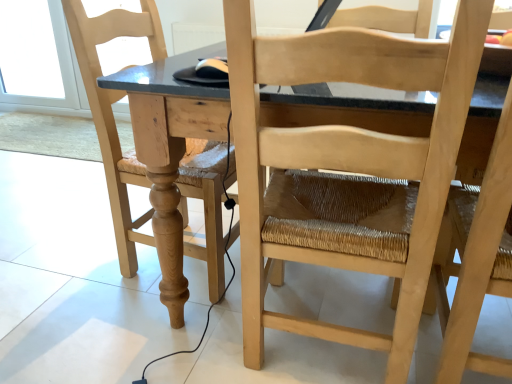
Question: Is natural wood chair at right, which is the 1th chair in right-to-left order, touching natural wood table at center?

Choices:
 (A) no
 (B) yes

Answer: (A)

Question: Does natural wood chair at right, which is the 1th chair in right-to-left order, have a smaller size compared to natural wood table at center?

Choices:
 (A) yes
 (B) no

Answer: (A)

Question: Is natural wood chair at right, which is the 1th chair in right-to-left order, wider than natural wood table at center?

Choices:
 (A) yes
 (B) no

Answer: (B)

Question: From a real-world perspective, is natural wood chair at right, the third chair positioned from the left, on natural wood table at center?

Choices:
 (A) yes
 (B) no

Answer: (A)

Question: Can we say natural wood chair at right, the third chair positioned from the left, lies outside natural wood table at center?

Choices:
 (A) no
 (B) yes

Answer: (A)

Question: From a real-world perspective, is natural wood table at center positioned above or below natural wood chair at left, the first chair in the left-to-right sequence?

Choices:
 (A) below
 (B) above

Answer: (A)

Question: Is natural wood table at center taller or shorter than natural wood chair at left, the third chair positioned from the right?

Choices:
 (A) short
 (B) tall

Answer: (A)

Question: Is point (122, 77) closer or farther from the camera than point (192, 140)?

Choices:
 (A) farther
 (B) closer

Answer: (B)

Question: From the image's perspective, is natural wood table at center above or below natural wood chair at left, the first chair in the left-to-right sequence?

Choices:
 (A) above
 (B) below

Answer: (B)

Question: Is natural wood chair at left, the first chair in the left-to-right sequence, in front of or behind natural wood table at center in the image?

Choices:
 (A) behind
 (B) front

Answer: (A)

Question: Is natural wood chair at left, the first chair in the left-to-right sequence, taller or shorter than natural wood table at center?

Choices:
 (A) short
 (B) tall

Answer: (B)

Question: From a real-world perspective, is natural wood chair at left, the first chair in the left-to-right sequence, above or below natural wood table at center?

Choices:
 (A) below
 (B) above

Answer: (B)

Question: From the image's perspective, is natural wood chair at left, the first chair in the left-to-right sequence, located above or below natural wood table at center?

Choices:
 (A) above
 (B) below

Answer: (A)

Question: Considering the positions of natural wood table at center and natural wood chair at center, the 2th chair positioned from the right, in the image, is natural wood table at center wider or thinner than natural wood chair at center, the 2th chair positioned from the right,?

Choices:
 (A) wide
 (B) thin

Answer: (A)

Question: Based on their sizes in the image, would you say natural wood table at center is bigger or smaller than natural wood chair at center, the 2th chair positioned from the right?

Choices:
 (A) small
 (B) big

Answer: (B)